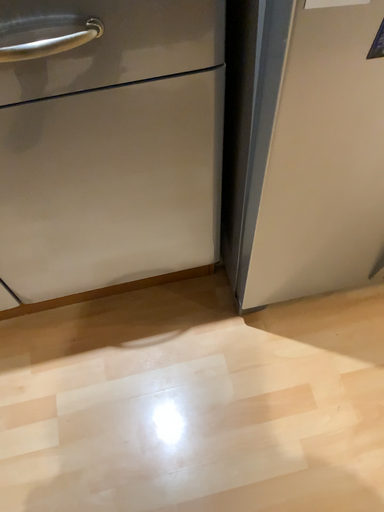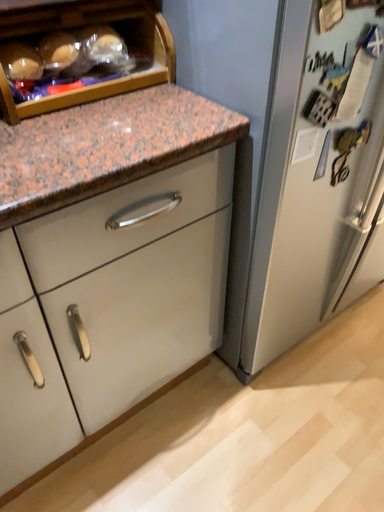
Question: How did the camera likely rotate when shooting the video?

Choices:
 (A) rotated left
 (B) rotated right

Answer: (B)